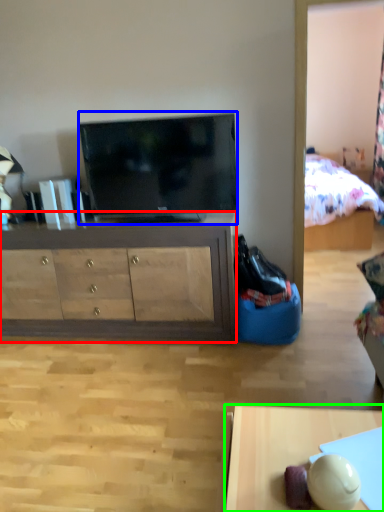
Question: Which object is the farthest from cabinetry (highlighted by a red box)? Choose among these: television (highlighted by a blue box) or desk (highlighted by a green box).

Choices:
 (A) television
 (B) desk

Answer: (B)